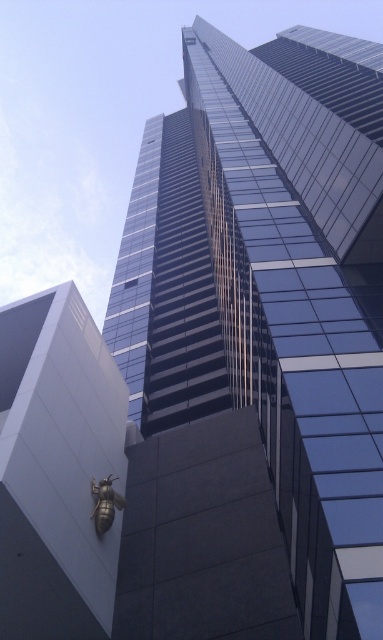
Who is more forward, (284, 147) or (50, 612)?

Point (50, 612) is in front.

Who is shorter, glassy blue skyscraper at center or gold metallic bee at lower left?

Standing shorter between the two is gold metallic bee at lower left.

Is point (317, 125) in front of point (27, 472)?

No, it is not.

Where is `glassy blue skyscraper at center`? The width and height of the screenshot is (383, 640). glassy blue skyscraper at center is located at coordinates (273, 291).